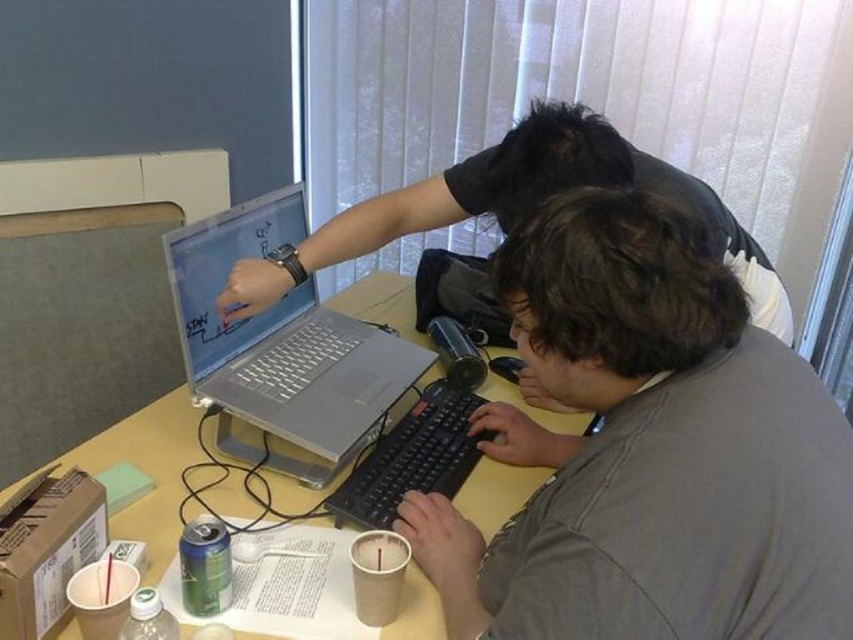
Question: Can you confirm if silver metallic laptop at center is bigger than black plastic keyboard at center?

Choices:
 (A) yes
 (B) no

Answer: (A)

Question: Which object is closer to the camera taking this photo?

Choices:
 (A) silver metallic laptop at center
 (B) matte silver laptop at center

Answer: (B)

Question: Which point is farther to the camera?

Choices:
 (A) (740, 374)
 (B) (477, 516)
 (C) (280, 240)

Answer: (C)

Question: Is matte black laptop at upper center to the left of silver metallic laptop at center from the viewer's perspective?

Choices:
 (A) no
 (B) yes

Answer: (A)

Question: Which point is closer to the camera taking this photo?

Choices:
 (A) (303, 218)
 (B) (415, 602)
 (C) (241, 280)

Answer: (B)

Question: Does silver metallic laptop at center-left have a greater width compared to black plastic keyboard at center?

Choices:
 (A) no
 (B) yes

Answer: (A)